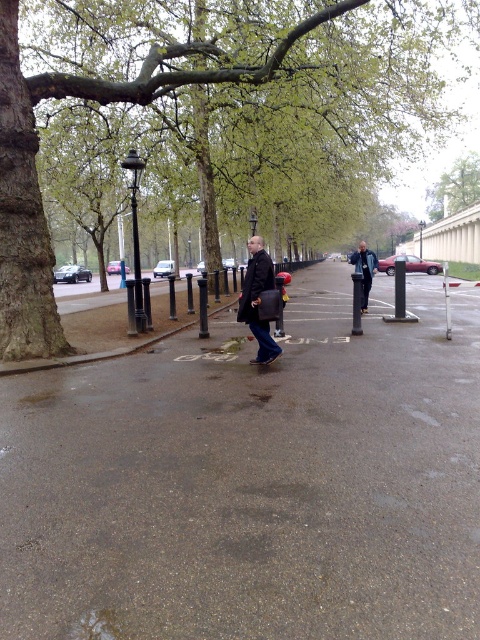
Does green leafy tree at center appear over dark matte jacket at center?

Yes, green leafy tree at center is above dark matte jacket at center.

Does green leafy tree at center have a greater width compared to dark matte jacket at center?

Yes.

Does point (13, 0) come behind point (244, 284)?

That is True.

You are a GUI agent. You are given a task and a screenshot of the screen. Output one action in this format:
    pyautogui.click(x=<x>, y=<y>)
    Task: Click on the green leafy tree at center
    The image size is (480, 640).
    Given the screenshot: What is the action you would take?
    click(x=36, y=148)

Which is in front, point (135, 496) or point (463, 205)?

Positioned in front is point (135, 496).

Does smooth asphalt pavement at center have a lesser height compared to green leafy tree at upper center?

Correct, smooth asphalt pavement at center is not as tall as green leafy tree at upper center.

I want to click on smooth asphalt pavement at center, so click(x=252, y=481).

How much distance is there between green leafy tree at center and green leafy tree at upper center?

52.54 meters

Between green leafy tree at center and green leafy tree at upper center, which one has less height?

green leafy tree at upper center is shorter.

The height and width of the screenshot is (640, 480). Describe the element at coordinates (36, 148) in the screenshot. I see `green leafy tree at center` at that location.

This screenshot has width=480, height=640. In order to click on green leafy tree at center in this screenshot , I will do `click(36, 148)`.